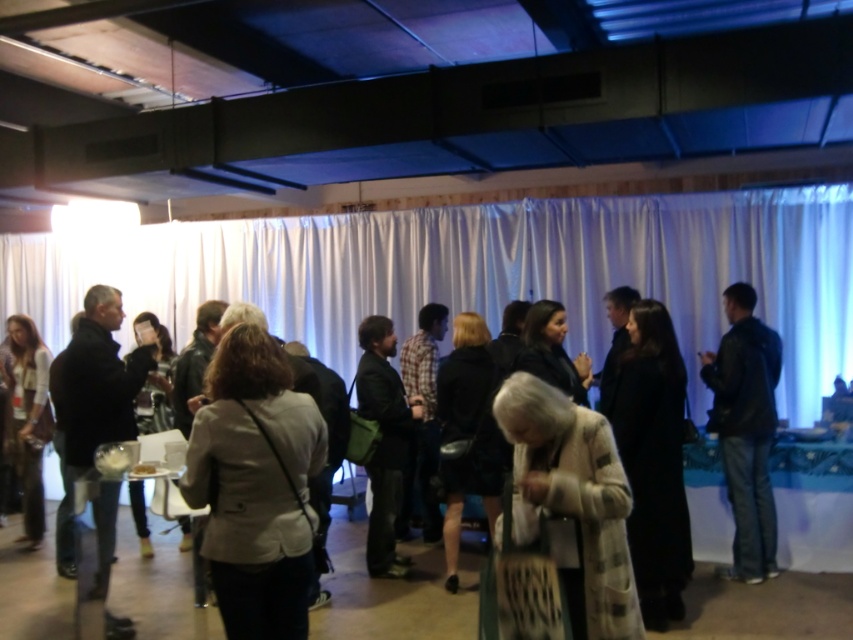
You are at a social event and need to choose between wearing the black leather jacket at left and the matte white shirt at left. Which one would you pick if you want to make a more noticeable fashion statement?

The black leather jacket at left is larger in size than the matte white shirt at left, making it a more eye catching choice for a fashion statement.

You are a photographer setting up a shoot in the room. You need to place a 1.8m tall tripod between the light beige jacket at center and the black leather jacket at right. Considering their heights, will the tripod be taller than both jackets?

Result: The light beige jacket at center is not as tall as the black leather jacket at right. Since the tripod is 1.8m tall, it will be taller than both jackets because even the taller black leather jacket at right is shorter than 1.8m.

You are standing in the room and see both the white textured coat at center and the dark brown leather jacket at center. Which one is nearer to you?

The white textured coat at center is closer to the viewer than the dark brown leather jacket at center, so the white textured coat at center is nearer to you.